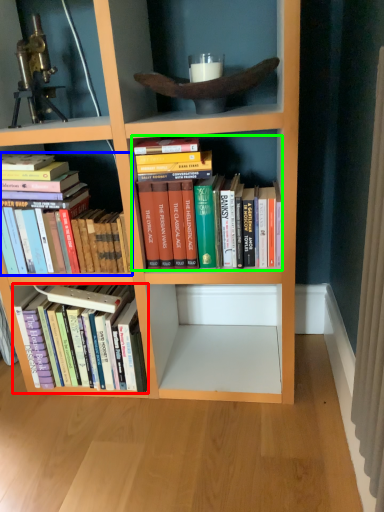
Question: Estimate the real-world distances between objects in this image. Which object is farther from book (highlighted by a red box), book (highlighted by a blue box) or book (highlighted by a green box)?

Choices:
 (A) book
 (B) book

Answer: (B)